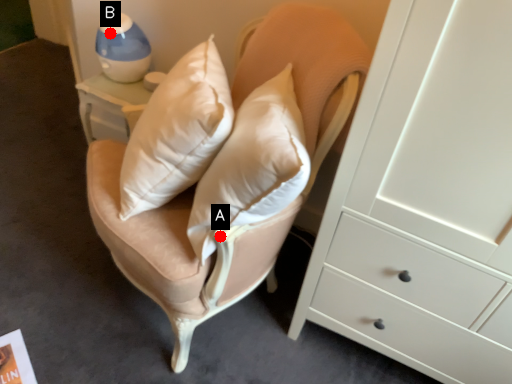
Question: Two points are circled on the image, labeled by A and B beside each circle. Which point is farther to the camera?

Choices:
 (A) A is further
 (B) B is further

Answer: (B)